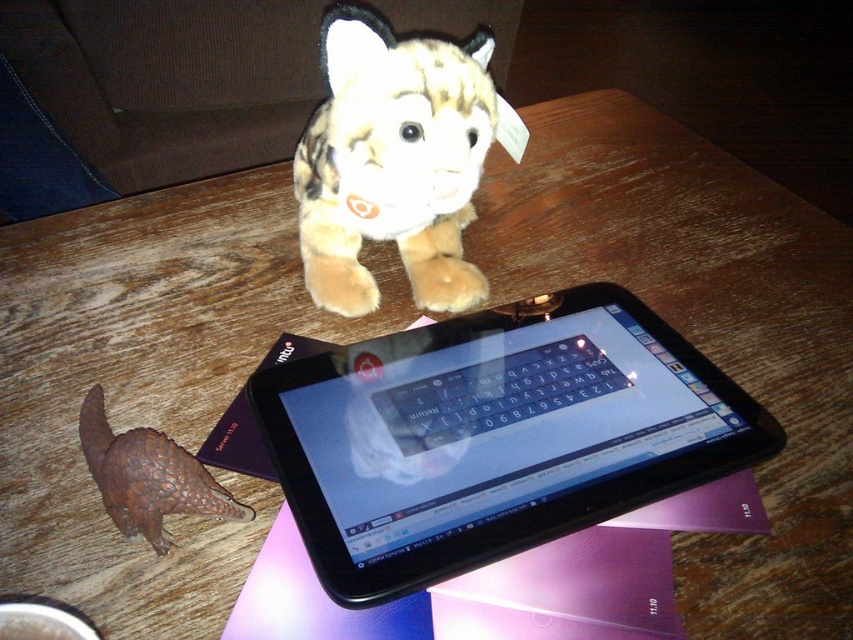
You are trying to determine which object is taller between the black plastic tablet at upper center and the fluffy brown plush toy at upper center. Based on the scene description, which one is taller?

The fluffy brown plush toy at upper center is taller than the black plastic tablet at upper center according to the description.

Based on the photo, you are organizing items on a table and need to place a new item between the black plastic tablet at upper center and the bumpy brown pangolin at lower left. What is the minimum distance you need to maintain between them to ensure the new item fits?

The minimum distance required is 7.22 inches, as the black plastic tablet at upper center is 7.22 inches away from the bumpy brown pangolin at lower left.